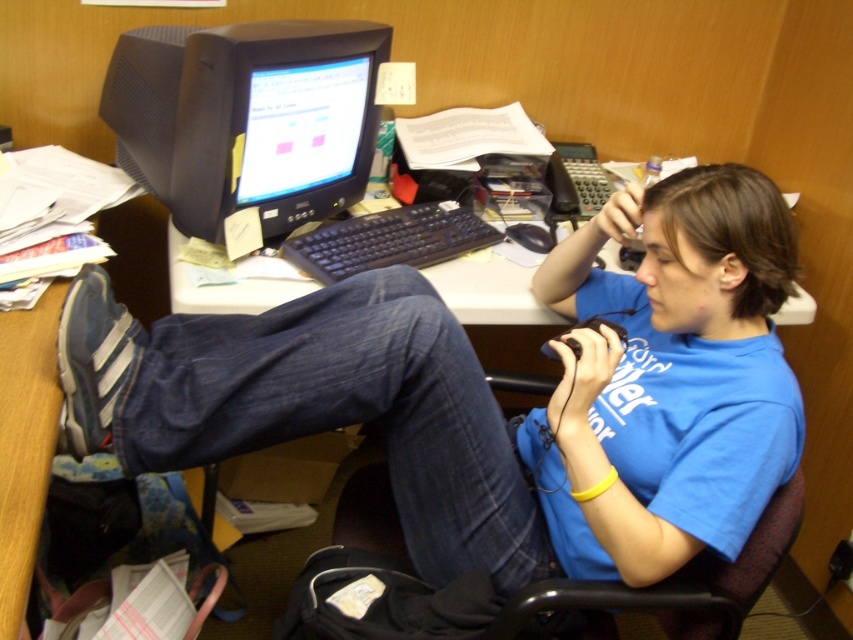
You are a delivery robot that needs to place a package on the desk. The package is 20 inches long. Can you fit it between the blue cotton shirt at center and the matte black monitor at center without moving any items?

The blue cotton shirt at center and matte black monitor at center are 19.36 inches apart. Since the package is 20 inches long, it cannot fit between them as the space is slightly smaller than the package.

Based on the photo, you are standing in front of the desk and want to reach the point at coordinates (502,282). If your arm can extend 4 feet, can you reach it?

The point at coordinates (502,282) is 4.89 feet from the camera, which is beyond your arm extension of 4 feet. You cannot reach it.

You are an office assistant who needs to make space on the desk for a new printer. The blue cotton shirt at center and the matte black monitor at center are currently occupying the space. Which object should you move first to free up more desk space?

The blue cotton shirt at center has a larger size compared to matte black monitor at center, so moving the blue cotton shirt at center first will free up more desk space.